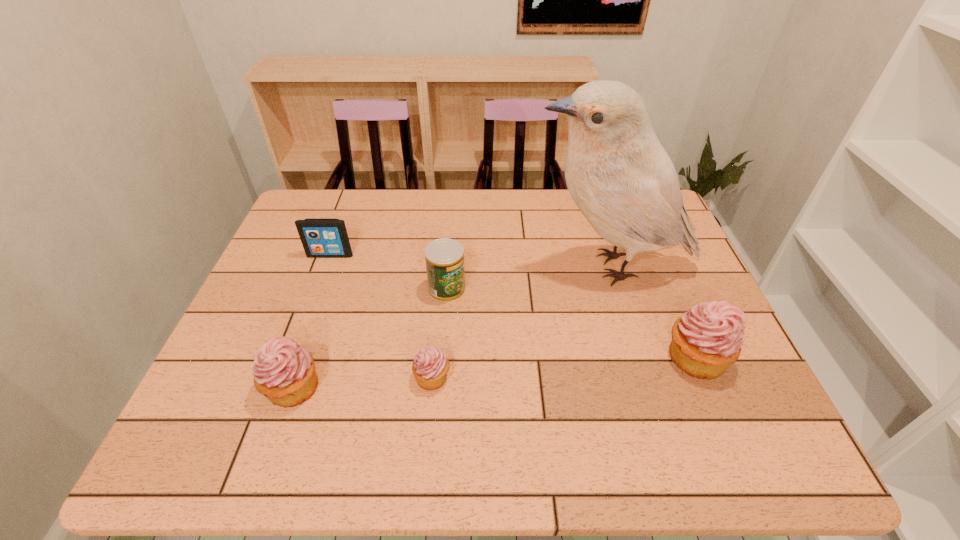
The height and width of the screenshot is (540, 960). In order to click on the second tallest cupcake in this screenshot , I will do `click(284, 372)`.

Identify the location of the shortest object. (430, 366).

I want to click on the shortest cupcake, so click(430, 366).

You are a GUI agent. You are given a task and a screenshot of the screen. Output one action in this format:
    pyautogui.click(x=<x>, y=<y>)
    Task: Click on the rightmost cupcake
    Image resolution: width=960 pixels, height=540 pixels.
    Given the screenshot: What is the action you would take?
    pos(708,338)

You are a GUI agent. You are given a task and a screenshot of the screen. Output one action in this format:
    pyautogui.click(x=<x>, y=<y>)
    Task: Click on the iPod
    The width and height of the screenshot is (960, 540).
    Given the screenshot: What is the action you would take?
    pyautogui.click(x=321, y=238)

You are a GUI agent. You are given a task and a screenshot of the screen. Output one action in this format:
    pyautogui.click(x=<x>, y=<y>)
    Task: Click on the can
    
    Given the screenshot: What is the action you would take?
    pyautogui.click(x=444, y=257)

Where is `parakeet`? The width and height of the screenshot is (960, 540). parakeet is located at coordinates (619, 175).

At what (x,y) coordinates should I click in order to perform the action: click on vacant space situated on the back of the leftmost cupcake. Please return your answer as a coordinate pair (x, y). Looking at the image, I should click on (311, 336).

Identify the location of free region located on the back of the shortest object. (444, 255).

The height and width of the screenshot is (540, 960). Find the location of `free space located 0.120m on the back of the rightmost cupcake`. free space located 0.120m on the back of the rightmost cupcake is located at coordinates (669, 297).